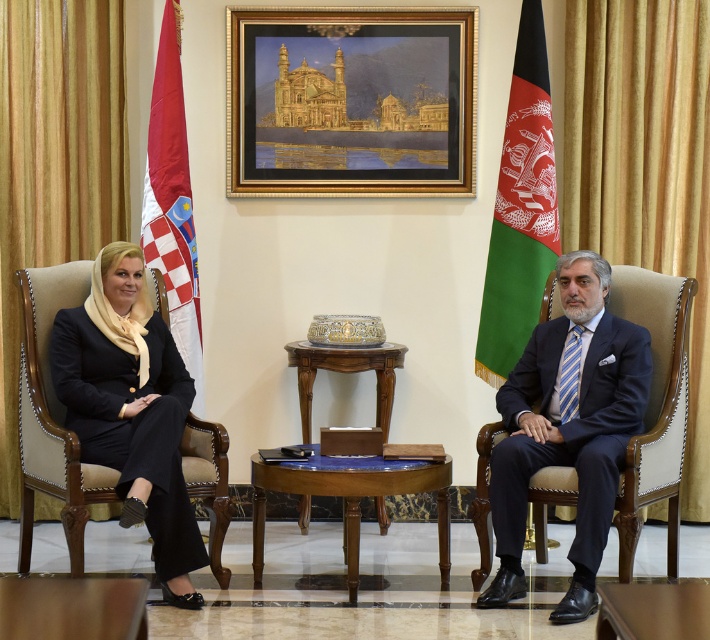
Question: Can you confirm if white fabric flag at left is thinner than wooden polished table at center?

Choices:
 (A) yes
 (B) no

Answer: (A)

Question: Which of the following is the closest to the observer?

Choices:
 (A) wooden table at center
 (B) green fabric flag at right

Answer: (A)

Question: Among these points, which one is farthest from the camera?

Choices:
 (A) (437, 461)
 (B) (185, 397)

Answer: (B)

Question: Among these points, which one is farthest from the camera?

Choices:
 (A) (532, 109)
 (B) (660, 416)
 (C) (427, 464)

Answer: (A)

Question: Is the position of gold-framed painting at upper center more distant than that of wooden polished table at center?

Choices:
 (A) no
 (B) yes

Answer: (B)

Question: From the image, what is the correct spatial relationship of wooden polished table at center in relation to glossy wood table at center?

Choices:
 (A) left
 (B) right

Answer: (A)